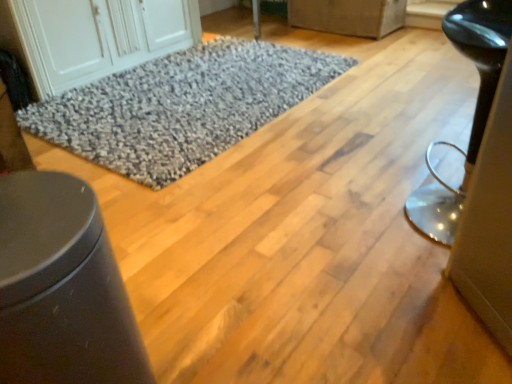
In order to click on free spot above gray shaggy rug at center (from a real-world perspective) in this screenshot , I will do `click(195, 84)`.